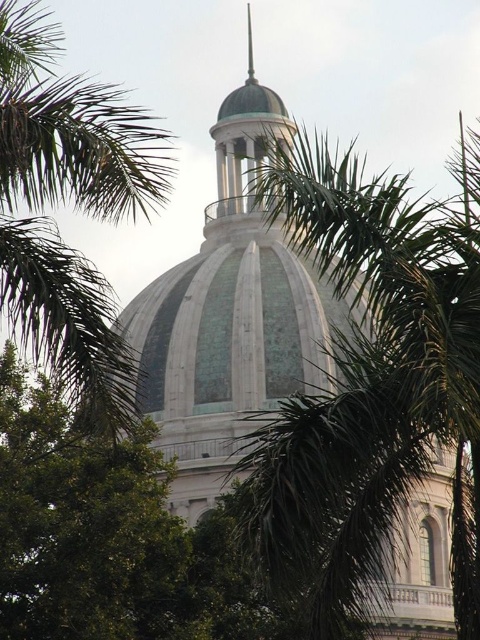
Between green leafy palm tree at center and green leafy palm tree at upper center, which one is positioned lower?

green leafy palm tree at center

Who is more forward, (405, 369) or (149, 145)?

Positioned in front is point (405, 369).

The width and height of the screenshot is (480, 640). Find the location of `green leafy palm tree at center`. green leafy palm tree at center is located at coordinates (372, 381).